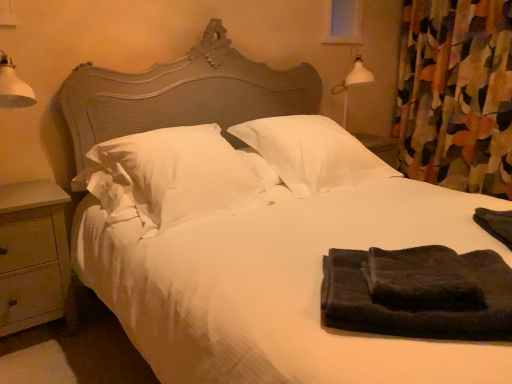
The height and width of the screenshot is (384, 512). What are the coordinates of `vacant region above black terry towel at lower right, marked as the 2th material in a back-to-front arrangement (from a real-world perspective)` in the screenshot? It's located at (416, 276).